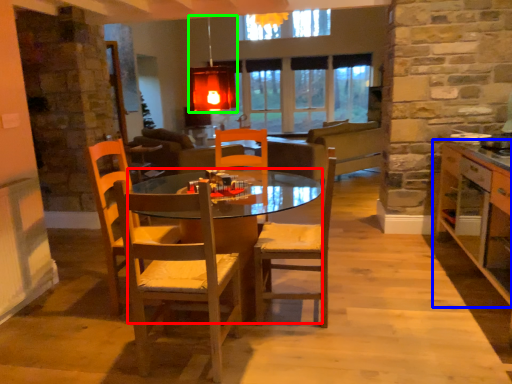
Question: Which object is the closest to the desk (highlighted by a red box)? Choose among these: cabinetry (highlighted by a blue box) or light fixture (highlighted by a green box).

Choices:
 (A) cabinetry
 (B) light fixture

Answer: (A)